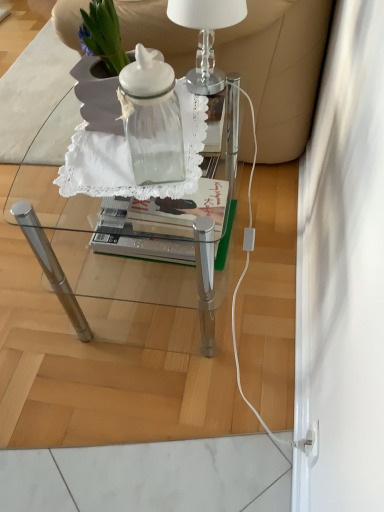
Locate an element on the screen. vacant space in front of transparent glass table at center is located at coordinates (161, 419).